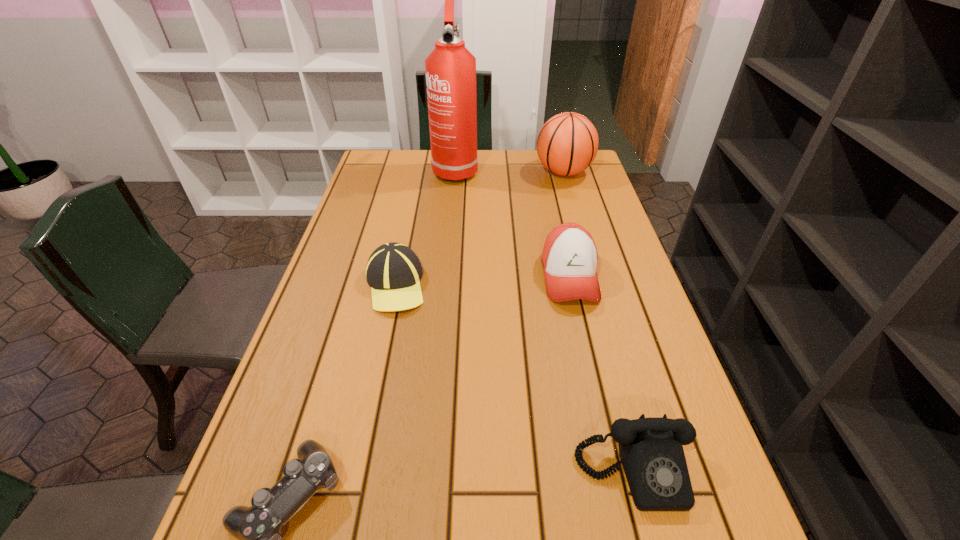
The height and width of the screenshot is (540, 960). I want to click on fire extinguisher that is at the far edge, so click(450, 68).

You are a GUI agent. You are given a task and a screenshot of the screen. Output one action in this format:
    pyautogui.click(x=<x>, y=<y>)
    Task: Click on the basketball present at the far edge
    Image resolution: width=960 pixels, height=540 pixels.
    Given the screenshot: What is the action you would take?
    pyautogui.click(x=567, y=144)

Identify the location of object at the left edge. (393, 271).

Image resolution: width=960 pixels, height=540 pixels. I want to click on basketball located in the right edge section of the desktop, so click(567, 144).

Find the location of a particular element. The height and width of the screenshot is (540, 960). baseball cap located in the right edge section of the desktop is located at coordinates (569, 258).

Identify the location of telephone situated at the right edge. This screenshot has width=960, height=540. (650, 449).

The height and width of the screenshot is (540, 960). In order to click on object positioned at the far right corner in this screenshot , I will do `click(567, 144)`.

The image size is (960, 540). Identify the location of blank area at the left edge. (339, 284).

Find the location of a particular element. The width and height of the screenshot is (960, 540). vacant space at the right edge of the desktop is located at coordinates (609, 222).

Locate an element on the screen. vacant space at the far left corner of the desktop is located at coordinates (373, 181).